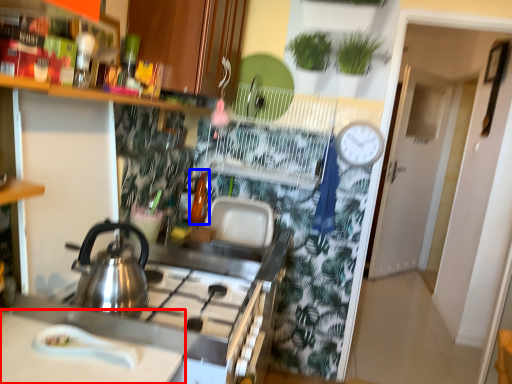
Question: Among these objects, which one is farthest to the camera, countertop (highlighted by a red box) or bottle (highlighted by a blue box)?

Choices:
 (A) countertop
 (B) bottle

Answer: (B)